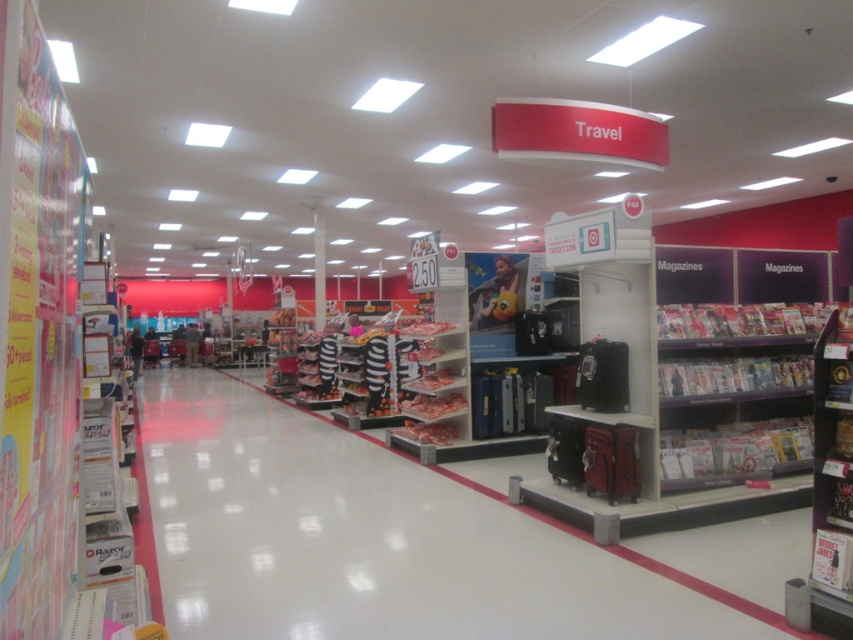
In the scene shown: Which is more to the left, hardcover book at center or metallic silver magazines at lower right?

hardcover book at center is more to the left.

Can you confirm if hardcover book at center is taller than metallic silver magazines at lower right?

Yes, hardcover book at center is taller than metallic silver magazines at lower right.

Between point (831, 316) and point (799, 378), which one is positioned in front?

Point (831, 316) is more forward.

Image resolution: width=853 pixels, height=640 pixels. In order to click on hardcover book at center in this screenshot , I will do `click(833, 432)`.

Is metallic suitcase at center bigger than hardcover book at center?

Yes.

Looking at this image, does metallic suitcase at center have a lesser height compared to hardcover book at center?

Yes.

Between point (294, 572) and point (845, 448), which one is positioned behind?

The point (294, 572) is more distant.

What are the coordinates of `metallic suitcase at center` in the screenshot? It's located at (412, 540).

This screenshot has width=853, height=640. Identify the location of metallic suitcase at center. (412, 540).

Locate an element on the screen. This screenshot has height=640, width=853. metallic suitcase at center is located at coordinates [412, 540].